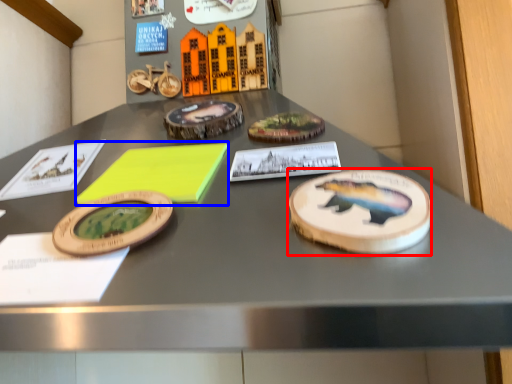
Question: Among these objects, which one is farthest to the camera, cake (highlighted by a red box) or notepad (highlighted by a blue box)?

Choices:
 (A) cake
 (B) notepad

Answer: (B)